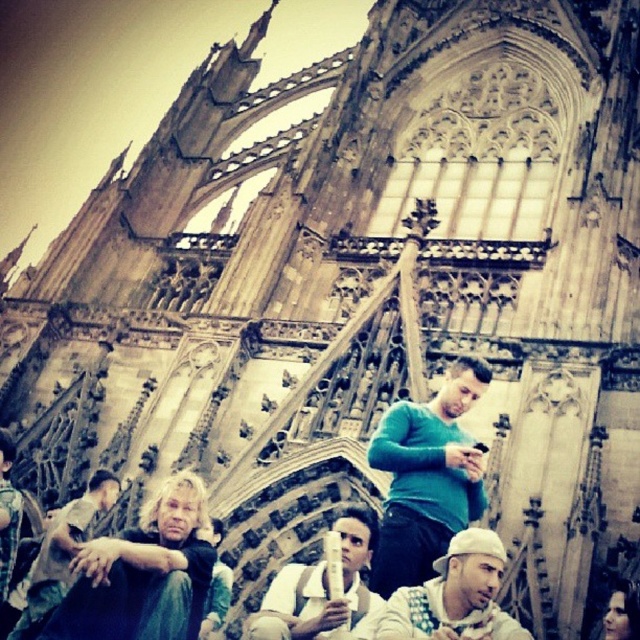
Is white matte hat at center above white fabric shirt at center?

Yes, white matte hat at center is above white fabric shirt at center.

Between point (442, 625) and point (376, 532), which one is positioned in front?

Point (442, 625)

Does point (388, 625) lie behind point (291, 589)?

No, it is not.

Where is `white matte hat at center`? The image size is (640, 640). white matte hat at center is located at coordinates (454, 595).

Does blonde hair man at lower left lie in front of blonde hair man at center?

That is True.

Can you confirm if blonde hair man at lower left is positioned to the left of blonde hair man at center?

No, blonde hair man at lower left is not to the left of blonde hair man at center.

Is point (180, 557) farther from camera compared to point (45, 605)?

That is False.

Locate an element on the screen. The height and width of the screenshot is (640, 640). blonde hair man at lower left is located at coordinates (144, 573).

Is the position of white matte hat at center less distant than that of blonde hair man at center?

Yes, it is.

Between white matte hat at center and blonde hair man at center, which one has more height?

Standing taller between the two is blonde hair man at center.

Is point (490, 604) farther from camera compared to point (108, 490)?

No, (490, 604) is closer to viewer.

At what (x,y) coordinates should I click in order to perform the action: click on white matte hat at center. Please return your answer as a coordinate pair (x, y). This screenshot has width=640, height=640. Looking at the image, I should click on (454, 595).